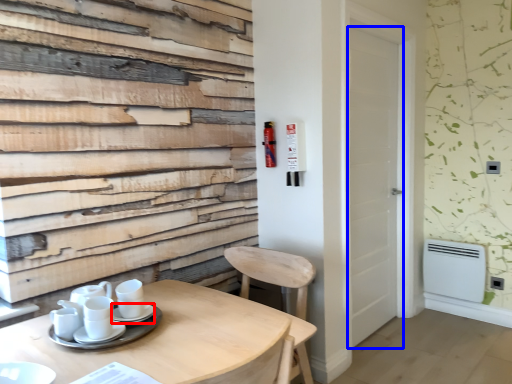
Question: Which of the following is the closest to the observer, saucer (highlighted by a red box) or door (highlighted by a blue box)?

Choices:
 (A) saucer
 (B) door

Answer: (A)